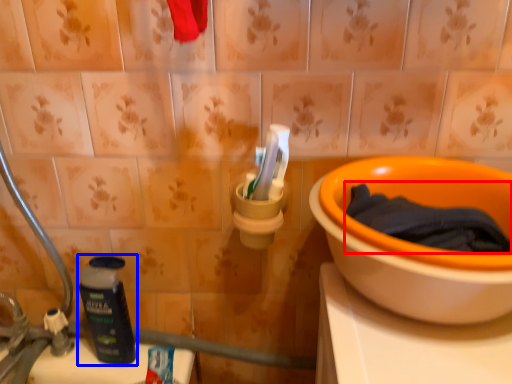
Question: Which object appears farthest to the camera in this image, bath towel (highlighted by a red box) or bottle (highlighted by a blue box)?

Choices:
 (A) bath towel
 (B) bottle

Answer: (B)